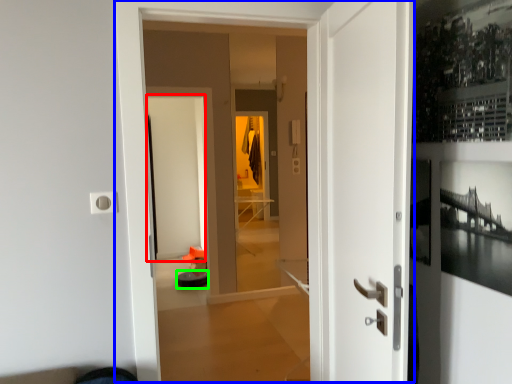
Question: Which is nearer to the screen door (highlighted by a red box)? door (highlighted by a blue box) or furniture (highlighted by a green box).

Choices:
 (A) door
 (B) furniture

Answer: (B)